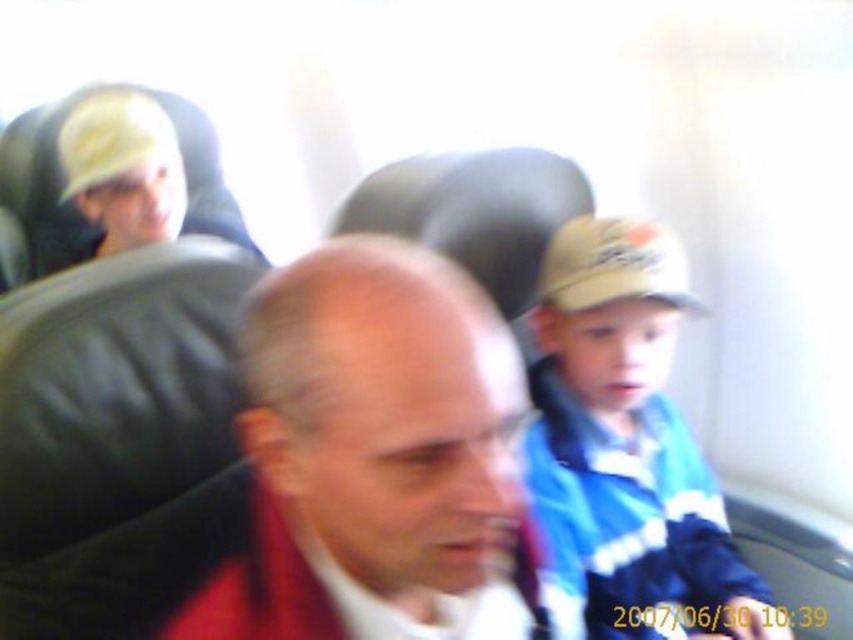
Question: Which of the following is the closest to the observer?

Choices:
 (A) (651, 266)
 (B) (520, 634)
 (C) (669, 436)

Answer: (B)

Question: Which point is farther to the camera?

Choices:
 (A) smooth red shirt at center
 (B) blue and white striped shirt at center

Answer: (B)

Question: Which of the following is the farthest from the observer?

Choices:
 (A) smooth red shirt at center
 (B) tan fabric baseball cap at center-right

Answer: (B)

Question: Does blue and white striped shirt at center appear over tan fabric baseball cap at center-right?

Choices:
 (A) yes
 (B) no

Answer: (B)

Question: Does smooth red shirt at center appear on the left side of tan fabric baseball cap at center-right?

Choices:
 (A) no
 (B) yes

Answer: (B)

Question: Can you confirm if smooth red shirt at center is positioned to the left of tan fabric baseball cap at center-right?

Choices:
 (A) yes
 (B) no

Answer: (A)